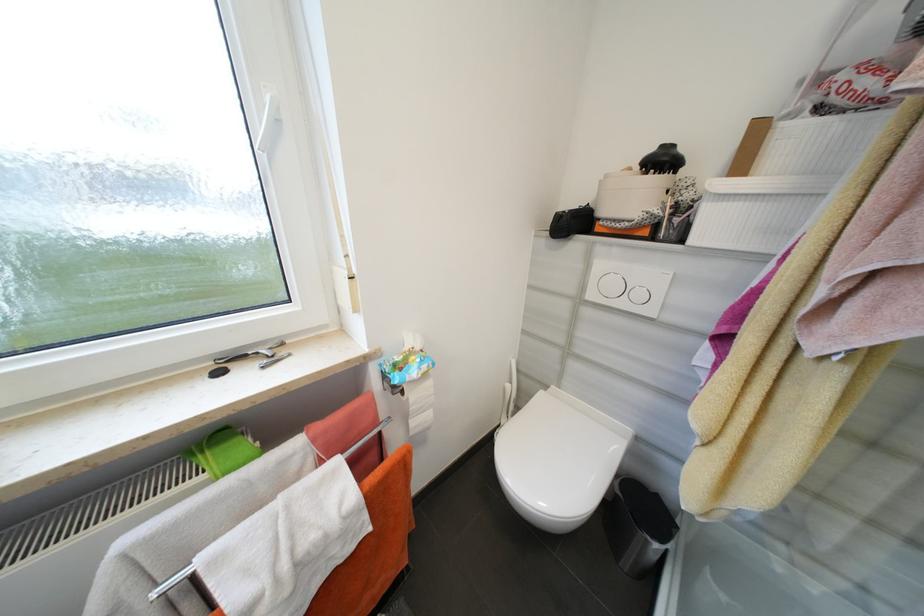
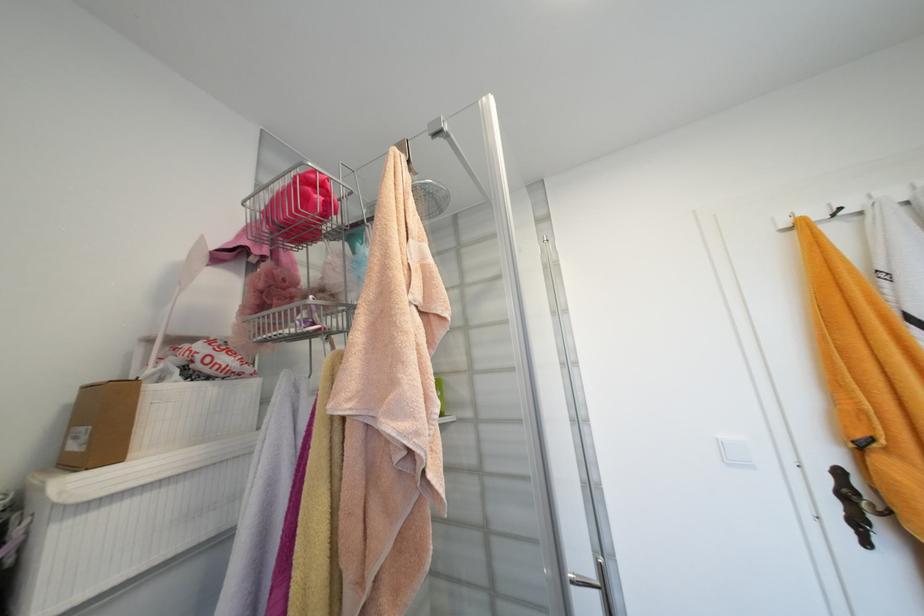
Where in the second image is the point corresponding to point 808,84 from the first image?

(154, 342)